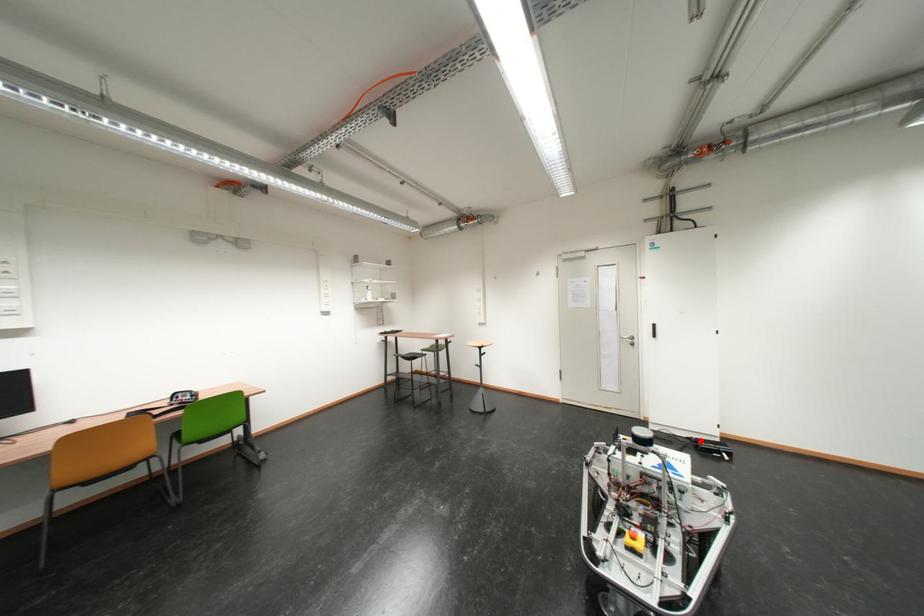
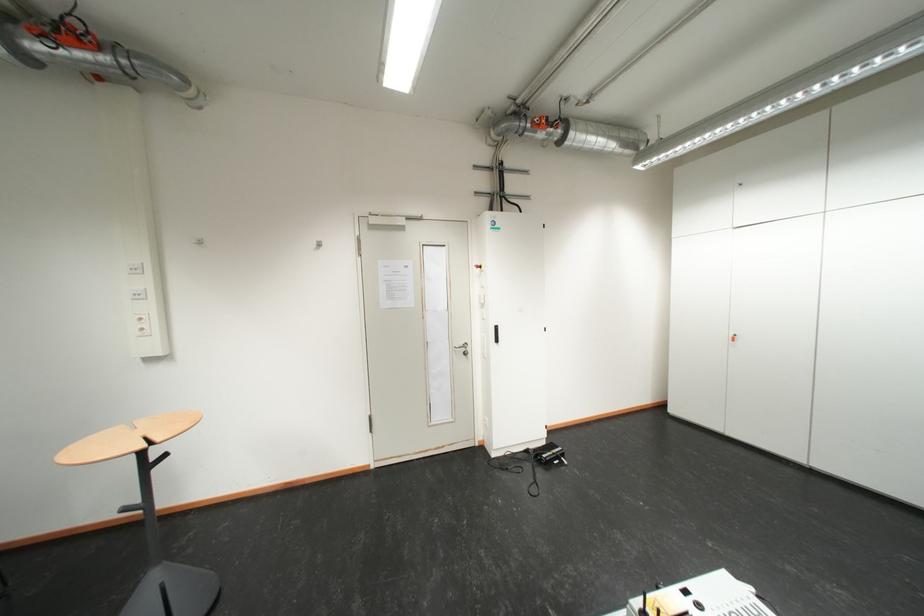
Question: A red point is marked in image1. In image2, is the corresponding 3D point closer to the camera or farther? Reply with the corresponding letter.

Choices:
 (A) The corresponding 3D point is closer.
 (B) The corresponding 3D point is farther.

Answer: (B)